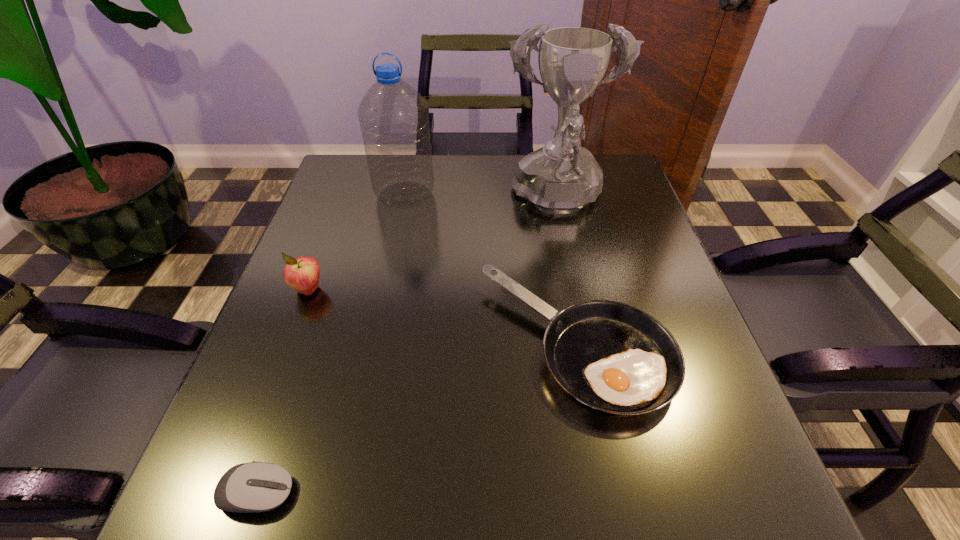
Image resolution: width=960 pixels, height=540 pixels. What are the coordinates of `object that is at the near left corner` in the screenshot? It's located at (253, 487).

The height and width of the screenshot is (540, 960). I want to click on object located in the far right corner section of the desktop, so click(x=562, y=177).

Where is `vacant space at the far edge`? vacant space at the far edge is located at coordinates (477, 156).

Image resolution: width=960 pixels, height=540 pixels. In order to click on free space at the near edge of the desktop in this screenshot , I will do `click(454, 525)`.

Find the location of `vacant area at the left edge`. vacant area at the left edge is located at coordinates (311, 326).

Where is `free location at the right edge`? free location at the right edge is located at coordinates click(609, 255).

The height and width of the screenshot is (540, 960). In the image, there is a desktop. Identify the location of vacant space at the far left corner. (367, 198).

This screenshot has width=960, height=540. Identify the location of vacant point at the far right corner. (612, 168).

The image size is (960, 540). Identify the location of vacant space at the near right corner of the desktop. (754, 505).

Identify the location of vacant point located between the apple and the water jug. (356, 242).